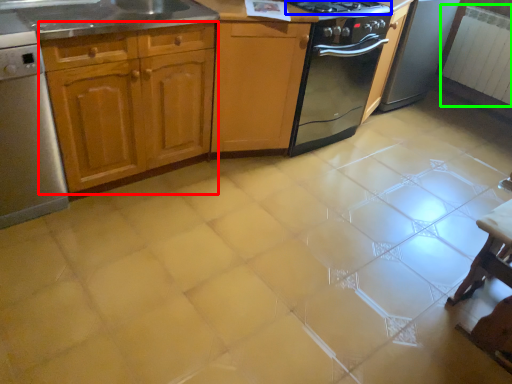
Question: Estimate the real-world distances between objects in this image. Which object is farther from cabinetry (highlighted by a red box), gas stove (highlighted by a blue box) or radiator (highlighted by a green box)?

Choices:
 (A) gas stove
 (B) radiator

Answer: (B)